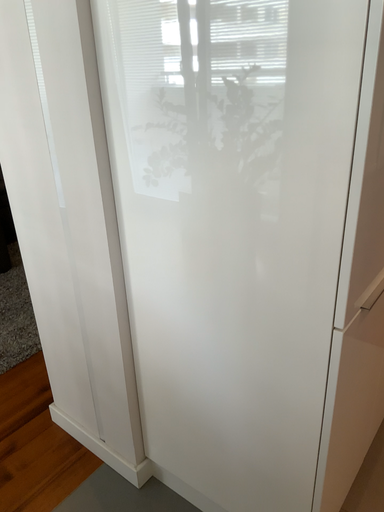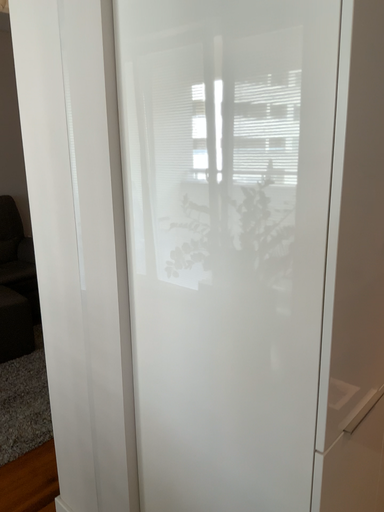
Question: Which way did the camera rotate in the video?

Choices:
 (A) rotated downward
 (B) rotated upward

Answer: (B)